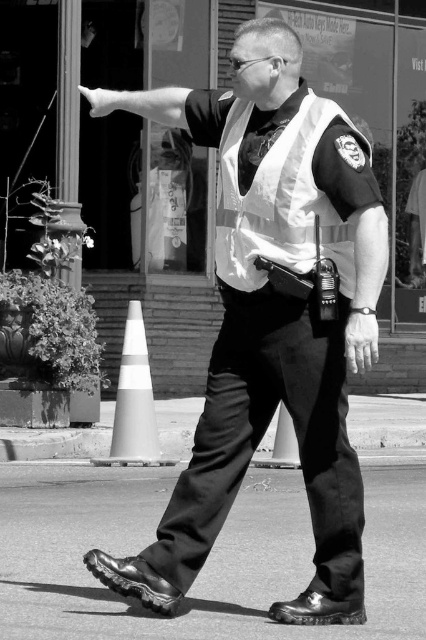
Based on the scene described, which object takes up more area in the image? Please choose between the white reflective vest at center and the smooth gray cone at lower center.

The smooth gray cone at lower center takes up more area in the image because the white reflective vest at center occupies less space than it.

You are a pedestrian standing at point (256, 465) and want to walk to the point where the man is pointing. The man is pointing at point (124, 385). Which direction should you walk relative to your current position?

You should walk forward because point (124, 385) is in front of point (256, 465).